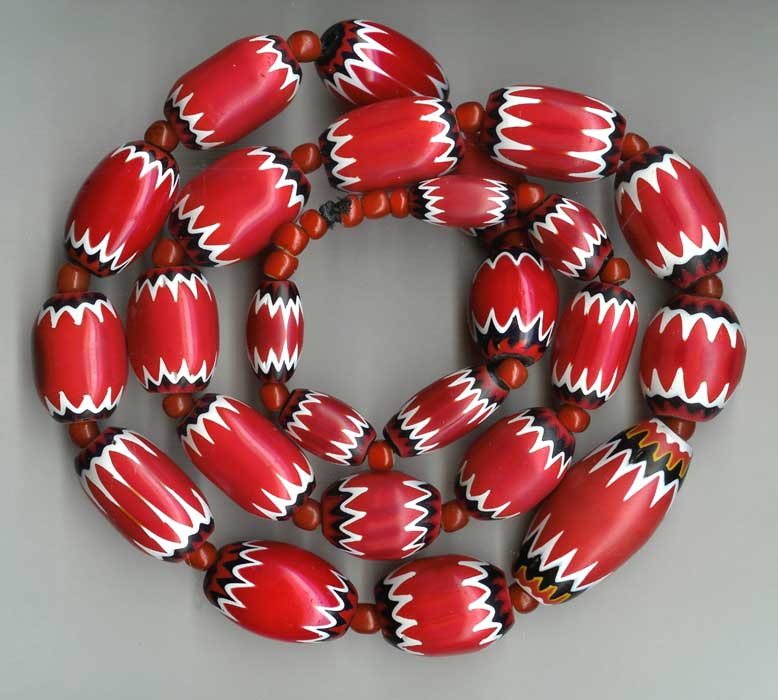
Where is `yellow paint`? The height and width of the screenshot is (700, 778). yellow paint is located at coordinates (551, 589).